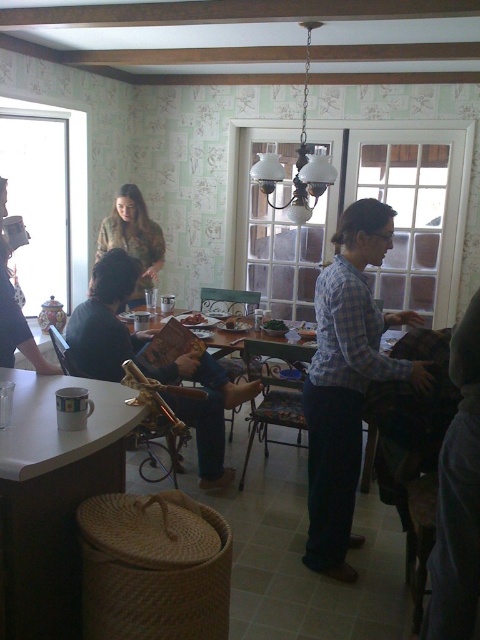
Question: Which point appears closest to the camera in this image?

Choices:
 (A) (187, 353)
 (B) (52, 621)
 (C) (217, 339)

Answer: (B)

Question: Does white matte table at lower left have a lesser width compared to matte brown book at center?

Choices:
 (A) no
 (B) yes

Answer: (B)

Question: Which of the following is the closest to the observer?

Choices:
 (A) white matte table at lower left
 (B) blue plaid shirt at center

Answer: (A)

Question: Does matte brown book at center come in front of woodenmaterial/texturetable at center?

Choices:
 (A) yes
 (B) no

Answer: (A)

Question: Can you confirm if white matte table at lower left is bigger than blue plaid shirt at center?

Choices:
 (A) yes
 (B) no

Answer: (B)

Question: Which point is closer to the camera?

Choices:
 (A) white matte table at lower left
 (B) woodenmaterial/texturetable at center

Answer: (A)